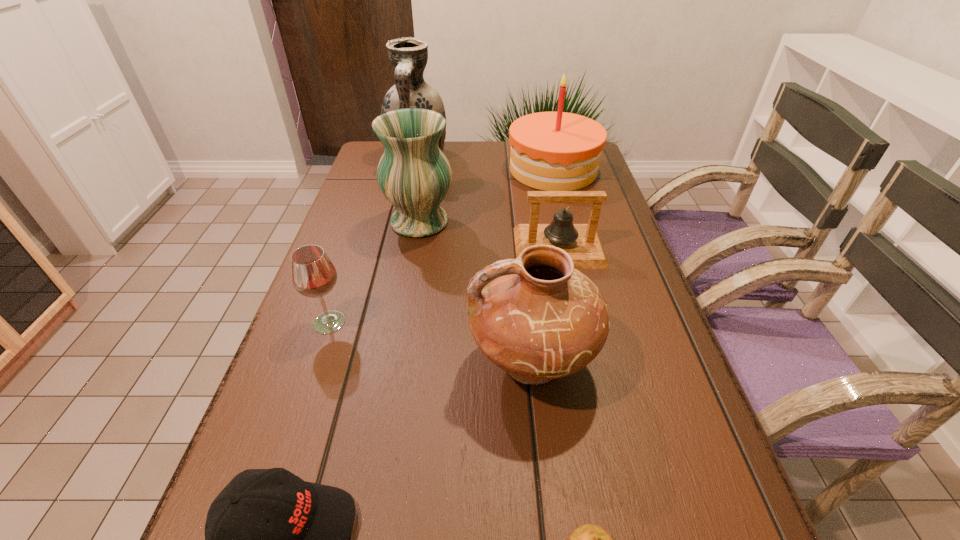
The width and height of the screenshot is (960, 540). In order to click on free space that satisfies the following two spatial constraints: 1. on the side of the pottery with the handle; 2. on the front side of the wineglass in this screenshot , I will do `click(527, 322)`.

This screenshot has width=960, height=540. I want to click on vacant region that satisfies the following two spatial constraints: 1. on the front side of the shorter vase; 2. on the side of the pottery with the handle, so click(395, 362).

Locate an element on the screen. The image size is (960, 540). free spot that satisfies the following two spatial constraints: 1. with the handle on the side of the taller vase; 2. on the right side of the shorter vase is located at coordinates (403, 222).

Image resolution: width=960 pixels, height=540 pixels. I want to click on free space that satisfies the following two spatial constraints: 1. on the side of the pottery with the handle; 2. on the right side of the birthday cake, so click(511, 170).